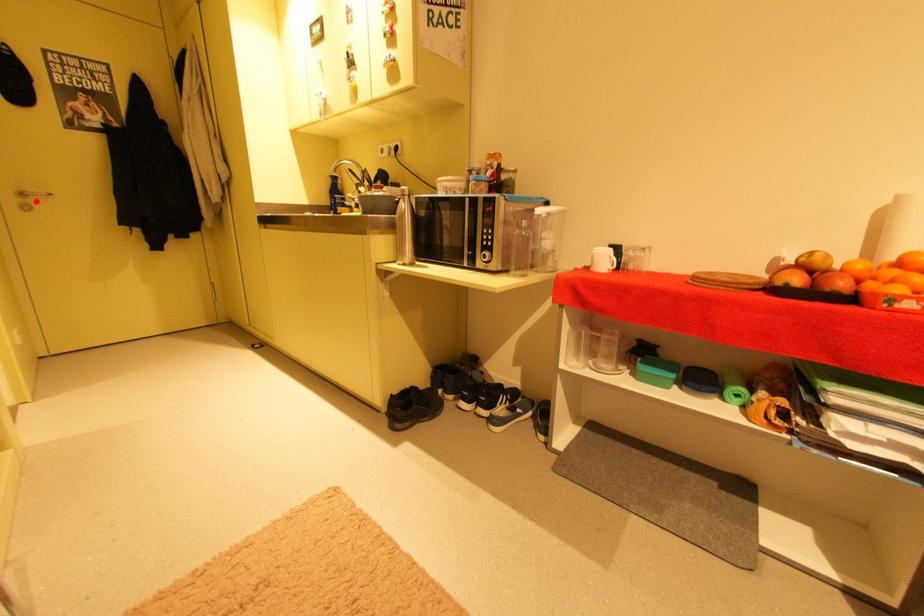
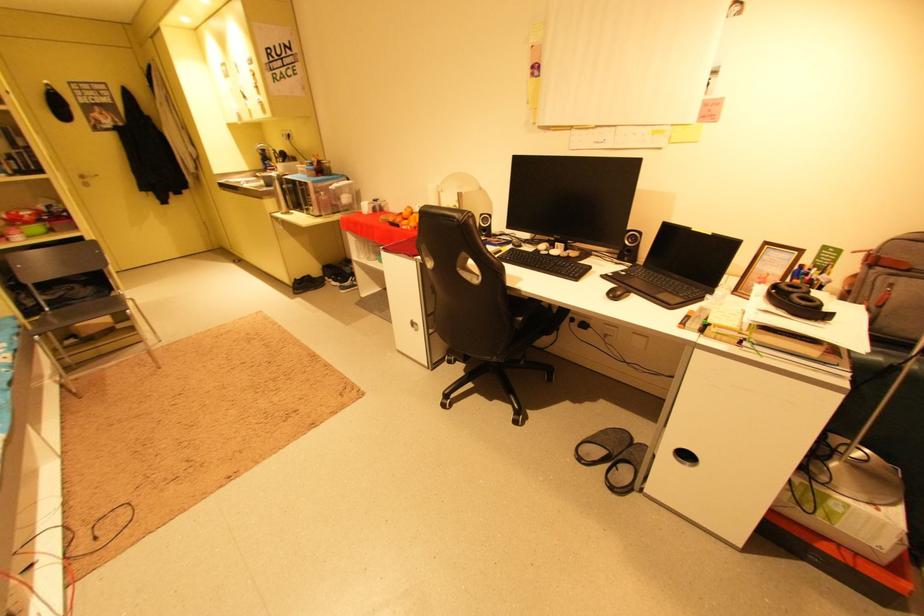
Find the pixel in the second image that matches the highlighted location in the first image.

(93, 180)